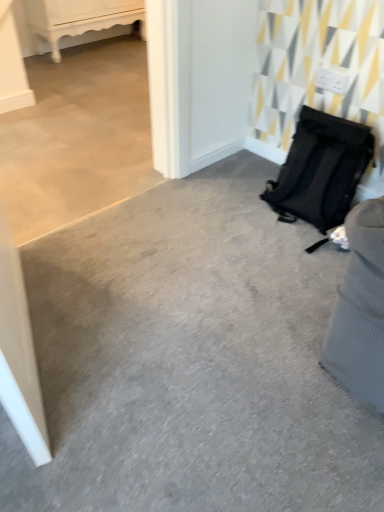
Question: Considering the relative sizes of white glossy cabinet at upper left and black fabric backpack at right in the image provided, is white glossy cabinet at upper left smaller than black fabric backpack at right?

Choices:
 (A) yes
 (B) no

Answer: (A)

Question: Considering the relative sizes of white glossy cabinet at upper left and black fabric backpack at right in the image provided, is white glossy cabinet at upper left thinner than black fabric backpack at right?

Choices:
 (A) no
 (B) yes

Answer: (B)

Question: Does white glossy cabinet at upper left have a lesser height compared to black fabric backpack at right?

Choices:
 (A) no
 (B) yes

Answer: (A)

Question: Is there a large distance between white glossy cabinet at upper left and black fabric backpack at right?

Choices:
 (A) yes
 (B) no

Answer: (A)

Question: Is white glossy cabinet at upper left bigger than black fabric backpack at right?

Choices:
 (A) no
 (B) yes

Answer: (A)

Question: Considering the positions of matte black backpack at right and black fabric backpack at right in the image, is matte black backpack at right wider or thinner than black fabric backpack at right?

Choices:
 (A) thin
 (B) wide

Answer: (A)

Question: Is matte black backpack at right spatially inside black fabric backpack at right, or outside of it?

Choices:
 (A) outside
 (B) inside

Answer: (A)

Question: Is matte black backpack at right bigger or smaller than black fabric backpack at right?

Choices:
 (A) small
 (B) big

Answer: (A)

Question: Visually, is matte black backpack at right positioned to the left or to the right of black fabric backpack at right?

Choices:
 (A) right
 (B) left

Answer: (A)

Question: From the image's perspective, is matte black backpack at right above or below white glossy cabinet at upper left?

Choices:
 (A) below
 (B) above

Answer: (A)

Question: In terms of height, does matte black backpack at right look taller or shorter compared to white glossy cabinet at upper left?

Choices:
 (A) tall
 (B) short

Answer: (B)

Question: Do you think matte black backpack at right is within white glossy cabinet at upper left, or outside of it?

Choices:
 (A) outside
 (B) inside

Answer: (A)

Question: Is matte black backpack at right wider or thinner than white glossy cabinet at upper left?

Choices:
 (A) thin
 (B) wide

Answer: (B)

Question: Is black fabric backpack at right in front of or behind white glossy cabinet at upper left in the image?

Choices:
 (A) behind
 (B) front

Answer: (B)

Question: Is point (160, 224) positioned closer to the camera than point (127, 8)?

Choices:
 (A) closer
 (B) farther

Answer: (A)